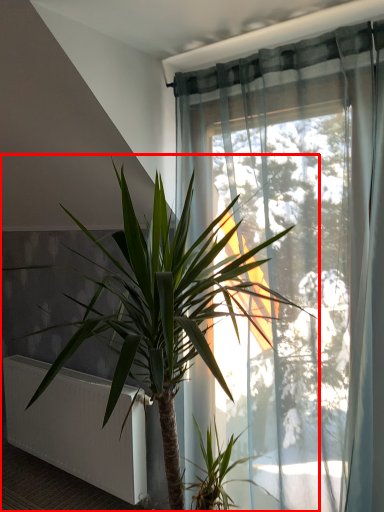
Question: Considering the relative positions of houseplant (annotated by the red box) and radiator in the image provided, where is houseplant (annotated by the red box) located with respect to the staircase?

Choices:
 (A) left
 (B) right

Answer: (B)